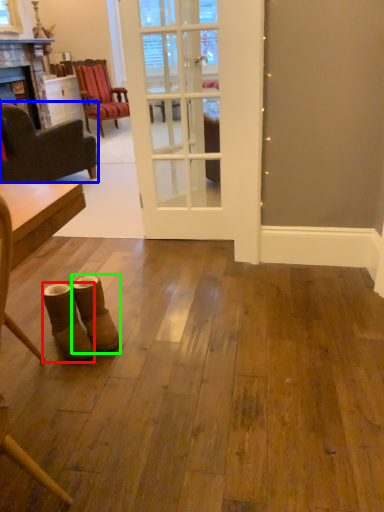
Question: Considering the real-world distances, which object is closest to footwear (highlighted by a red box)? chair (highlighted by a blue box) or footwear (highlighted by a green box).

Choices:
 (A) chair
 (B) footwear

Answer: (B)